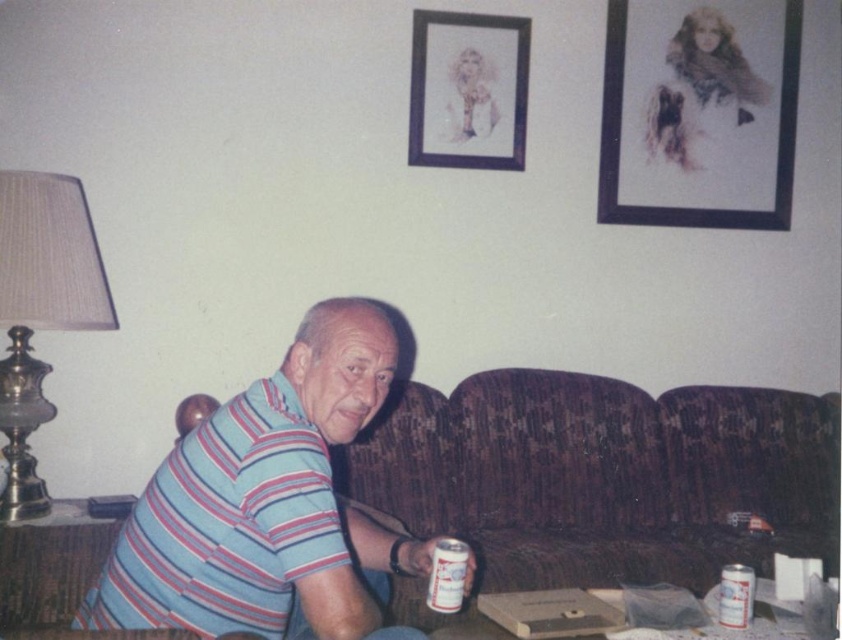
Question: Which object appears closest to the camera in this image?

Choices:
 (A) striped cotton shirt at center
 (B) matte black picture frame at upper center
 (C) metallic brass lampshade at left

Answer: (A)

Question: Is black paper at upper right positioned before white matte can at lower right?

Choices:
 (A) yes
 (B) no

Answer: (B)

Question: Which object appears farthest from the camera in this image?

Choices:
 (A) white matte can at lower center
 (B) metallic brass lampshade at left

Answer: (B)

Question: Considering the relative positions of brown fabric couch at center and metallic brass lampshade at left in the image provided, where is brown fabric couch at center located with respect to metallic brass lampshade at left?

Choices:
 (A) below
 (B) above

Answer: (A)

Question: Is metallic brass lampshade at left to the right of white matte can at lower right from the viewer's perspective?

Choices:
 (A) no
 (B) yes

Answer: (A)

Question: Estimate the real-world distances between objects in this image. Which object is farther from the brown fabric couch at center?

Choices:
 (A) metallic brass lampshade at left
 (B) matte black picture frame at upper center

Answer: (A)